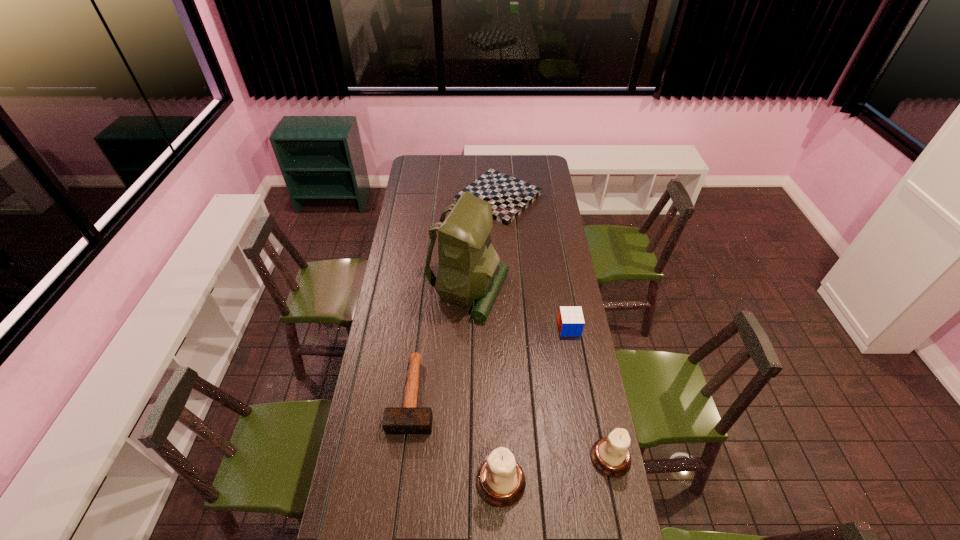
This screenshot has width=960, height=540. I want to click on free spot that satisfies the following two spatial constraints: 1. on the back side of the third shortest object; 2. on the right side of the taller candle holder, so click(496, 328).

This screenshot has width=960, height=540. I want to click on free space that satisfies the following two spatial constraints: 1. on the front side of the farthest object; 2. on the front of the backpack with visible pockets, so click(x=503, y=292).

Where is `free space in the image that satisfies the following two spatial constraints: 1. on the front side of the checkerboard; 2. on the front of the tallest object with visible pockets`? free space in the image that satisfies the following two spatial constraints: 1. on the front side of the checkerboard; 2. on the front of the tallest object with visible pockets is located at coordinates (503, 292).

Identify the location of vacant point that satisfies the following two spatial constraints: 1. on the front of the tallest object with visible pockets; 2. on the right side of the third tallest object. This screenshot has height=540, width=960. (464, 458).

The height and width of the screenshot is (540, 960). Identify the location of vacant space that satisfies the following two spatial constraints: 1. on the front of the backpack with visible pockets; 2. on the left side of the fourth tallest object. (468, 328).